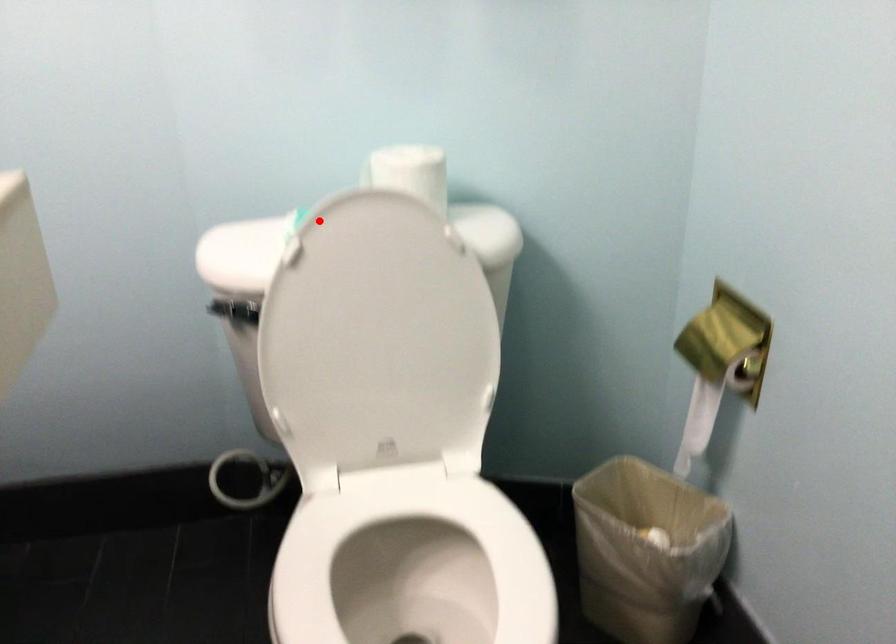
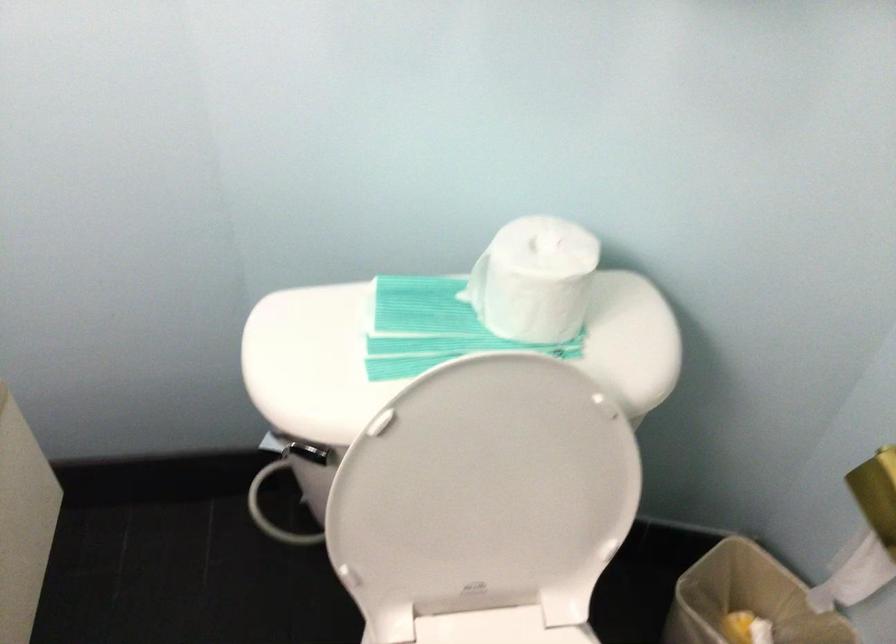
Question: I am providing you with two images of the same scene from different viewpoints. Image1 has a red point marked. In image2, the corresponding 3D location appears at what relative position? Reply with the corresponding letter.

Choices:
 (A) Closer
 (B) Farther

Answer: (A)